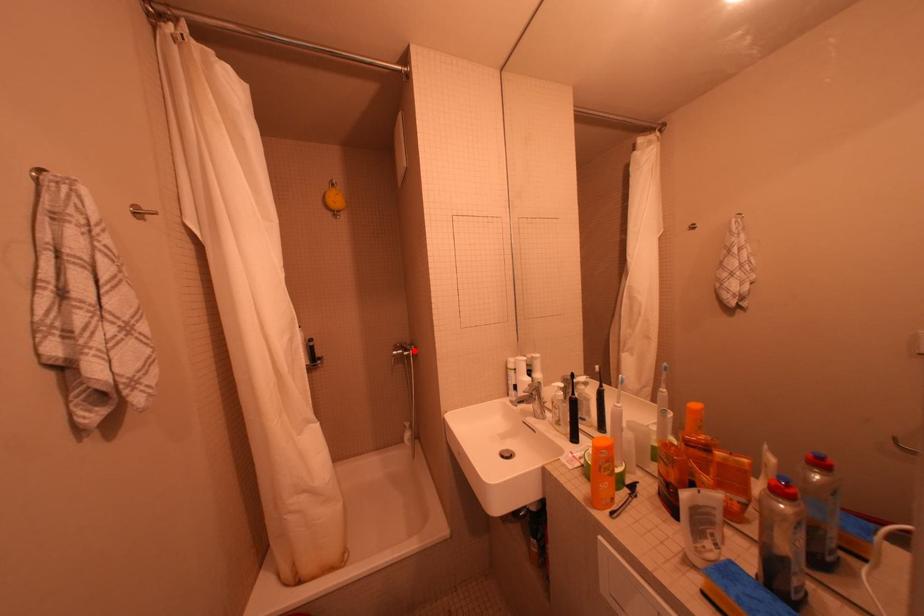
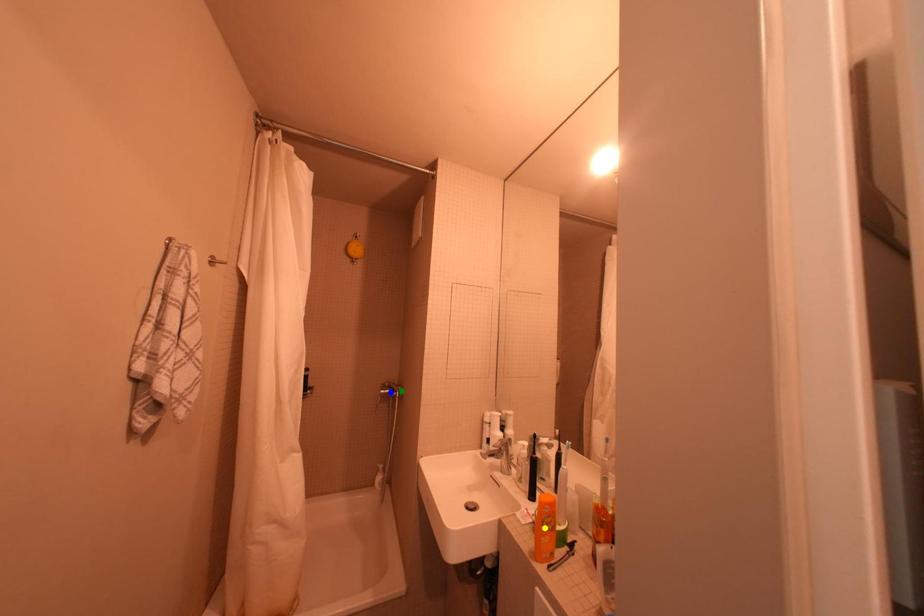
Question: I am providing you with two images of the same scene from different viewpoints. A red point is marked on the first image. You are given multiple points on the second image. Can you choose the point in image 2 that corresponds to the point in image 1?

Choices:
 (A) green point
 (B) blue point
 (C) yellow point

Answer: (A)